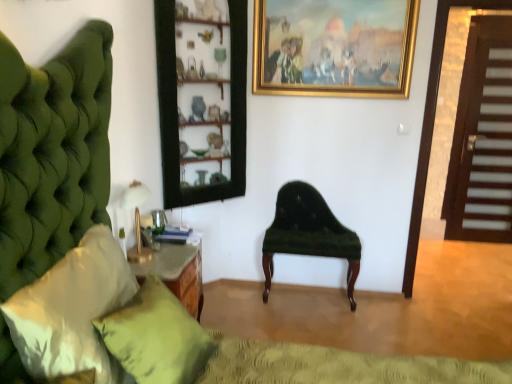
Identify the location of vacant space to the left of velvet green bench at center. This screenshot has height=384, width=512. (243, 309).